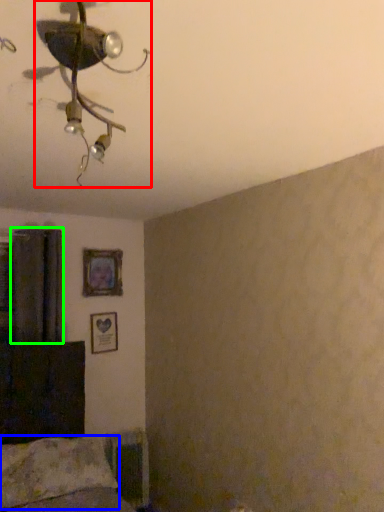
Question: Which object is positioned farthest from lamp (highlighted by a red box)? Select from pillow (highlighted by a blue box) and curtain (highlighted by a green box).

Choices:
 (A) pillow
 (B) curtain

Answer: (A)